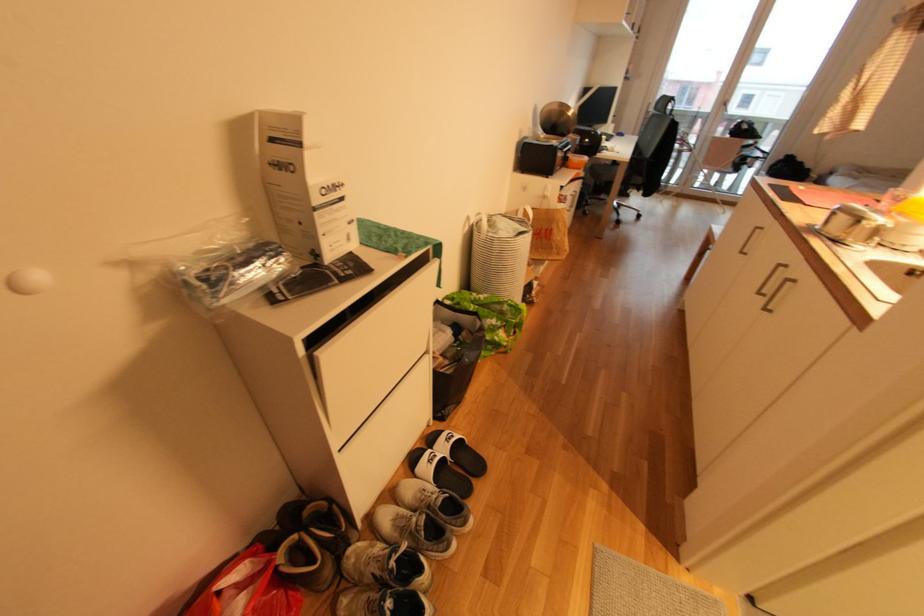
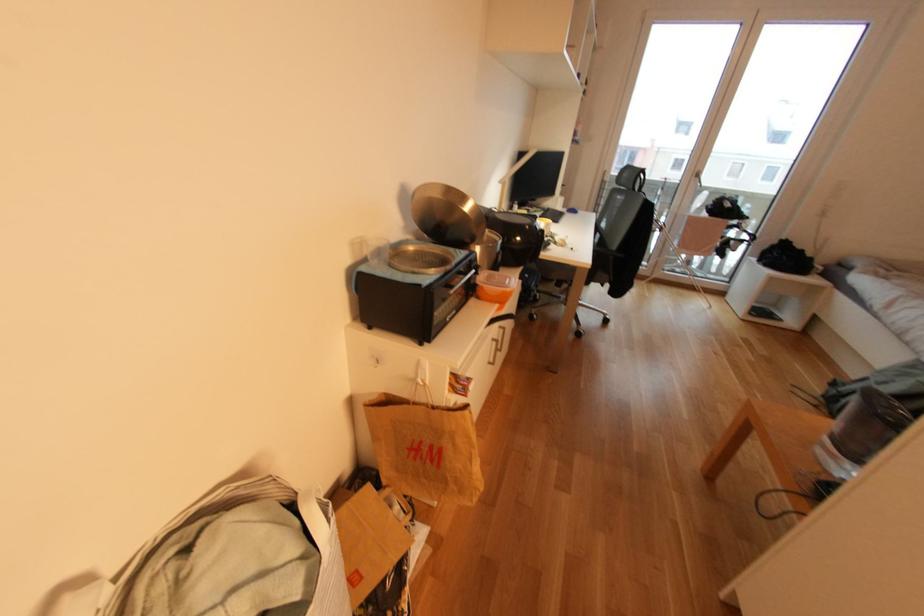
What movement of the cameraman would produce the second image?

The cameraman moved toward right, forward.